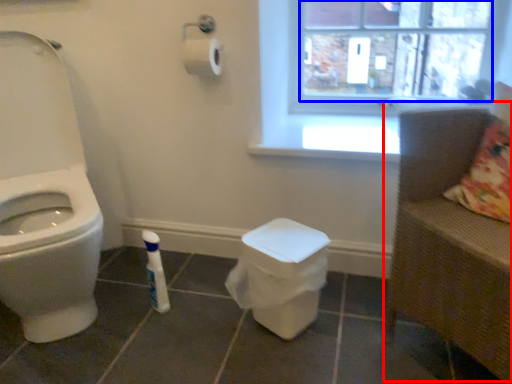
Question: Among these objects, which one is nearest to the camera, armchair (highlighted by a red box) or window screen (highlighted by a blue box)?

Choices:
 (A) armchair
 (B) window screen

Answer: (A)